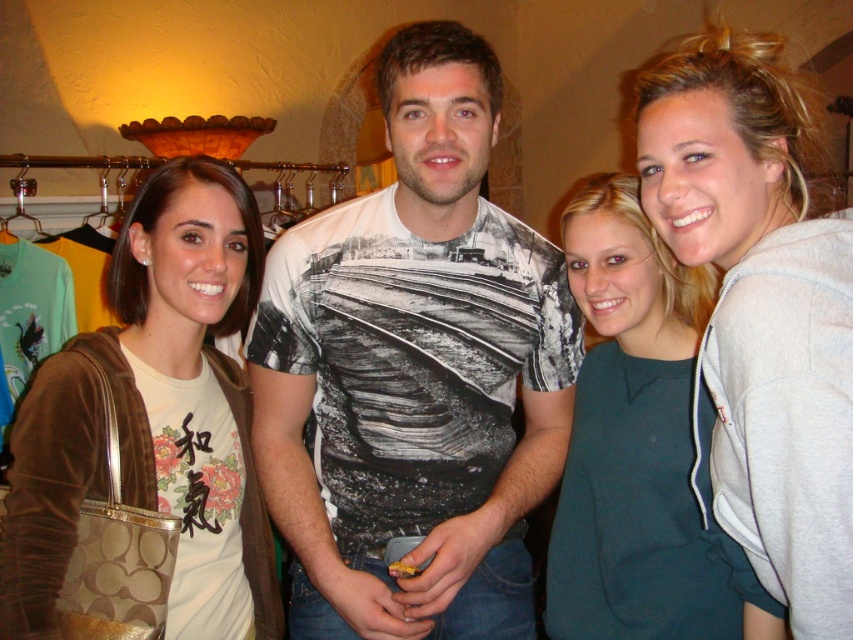
Which of these two, gray fleece sweatshirt at right or brown suede jacket at left, stands taller?

Standing taller between the two is brown suede jacket at left.

The image size is (853, 640). Identify the location of gray fleece sweatshirt at right. (759, 316).

Who is positioned more to the right, brown suede jacket at left or teal matte dress at center?

Positioned to the right is teal matte dress at center.

Is brown suede jacket at left taller than teal matte dress at center?

Indeed, brown suede jacket at left has a greater height compared to teal matte dress at center.

Is point (161, 246) positioned in front of point (614, 289)?

Yes, point (161, 246) is closer to viewer.

Find the location of a particular element. This screenshot has height=640, width=853. brown suede jacket at left is located at coordinates (154, 417).

Can you confirm if white printed t-shirt at center is shorter than brown suede jacket at left?

Incorrect, white printed t-shirt at center's height does not fall short of brown suede jacket at left's.

Which is more to the right, white printed t-shirt at center or brown suede jacket at left?

white printed t-shirt at center is more to the right.

Which is in front, point (370, 340) or point (190, 557)?

Point (190, 557) is more forward.

What are the coordinates of `white printed t-shirt at center` in the screenshot? It's located at (415, 372).